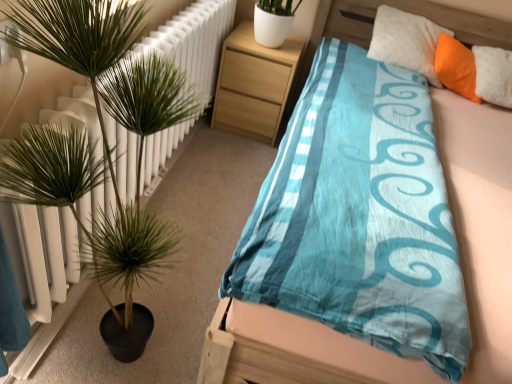
Question: Is green leafy plant at left taller than light wood/texture nightstand at upper center?

Choices:
 (A) no
 (B) yes

Answer: (B)

Question: Is green leafy plant at left looking in the opposite direction of light wood/texture nightstand at upper center?

Choices:
 (A) yes
 (B) no

Answer: (B)

Question: Is green leafy plant at left thinner than light wood/texture nightstand at upper center?

Choices:
 (A) no
 (B) yes

Answer: (B)

Question: Considering the relative positions of green leafy plant at left and light wood/texture nightstand at upper center in the image provided, is green leafy plant at left to the left of light wood/texture nightstand at upper center from the viewer's perspective?

Choices:
 (A) yes
 (B) no

Answer: (A)

Question: Is green leafy plant at left further to camera compared to light wood/texture nightstand at upper center?

Choices:
 (A) yes
 (B) no

Answer: (B)

Question: From the image's perspective, is green leafy plant at left located above or below light wood/texture nightstand at upper center?

Choices:
 (A) below
 (B) above

Answer: (A)

Question: Which is correct: green leafy plant at left is inside light wood/texture nightstand at upper center, or outside of it?

Choices:
 (A) inside
 (B) outside

Answer: (B)

Question: Is green leafy plant at left taller or shorter than light wood/texture nightstand at upper center?

Choices:
 (A) short
 (B) tall

Answer: (B)

Question: From a real-world perspective, relative to light wood/texture nightstand at upper center, is green leafy plant at left vertically above or below?

Choices:
 (A) below
 (B) above

Answer: (B)

Question: Is light wood/texture nightstand at upper center to the left or to the right of blue satin bed at center in the image?

Choices:
 (A) left
 (B) right

Answer: (A)

Question: Is point (224, 72) closer or farther from the camera than point (480, 241)?

Choices:
 (A) closer
 (B) farther

Answer: (B)

Question: In terms of width, does light wood/texture nightstand at upper center look wider or thinner when compared to blue satin bed at center?

Choices:
 (A) wide
 (B) thin

Answer: (B)

Question: Considering their positions, is light wood/texture nightstand at upper center located in front of or behind blue satin bed at center?

Choices:
 (A) front
 (B) behind

Answer: (B)

Question: From a real-world perspective, is blue satin bed at center above or below light wood/texture nightstand at upper center?

Choices:
 (A) above
 (B) below

Answer: (A)

Question: Is blue satin bed at center wider or thinner than light wood/texture nightstand at upper center?

Choices:
 (A) thin
 (B) wide

Answer: (B)